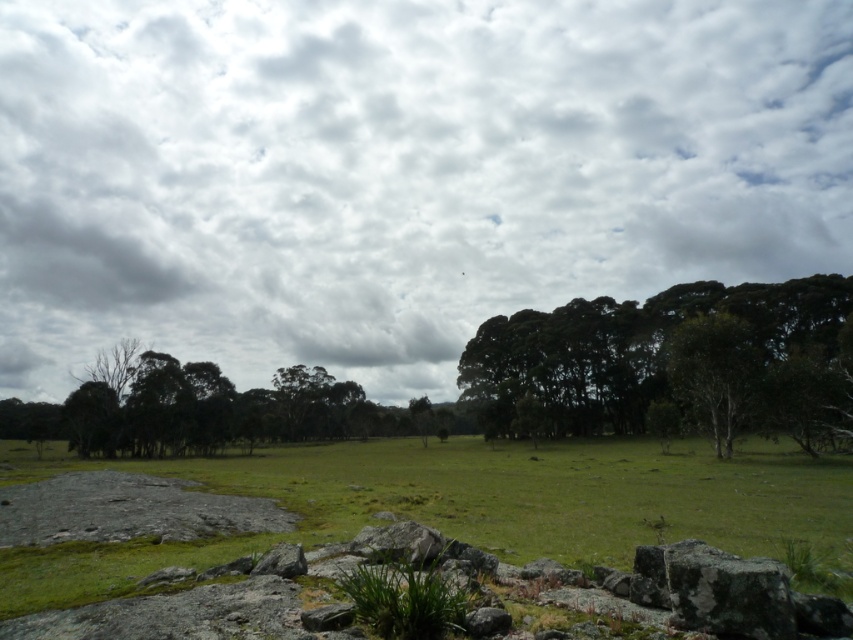
You are an airplane pilot preparing for a landing. You notice the cloudy sky at upper center and the green leafy trees at center in your view. Based on the distance between them, can you estimate if there is enough space for your plane to safely descend between them?

The distance between the cloudy sky at upper center and the green leafy trees at center is 609.20 feet. This distance is sufficient for a plane to safely descend between them during landing, as typical landing paths require a minimum clearance of around 500 feet.

You are standing at the origin point of the image coordinate system, which is the bottom left corner. You want to walk towards the green leafy trees at center. In which direction should you move relative to your current position?

Since the green leafy trees at center are located at point (674, 362) in the image coordinate system, you should move northeast to reach them. The x coordinate 0.566 is to the right and the y coordinate 0.791 is upwards from the origin, so combining both directions results in a northeast direction.